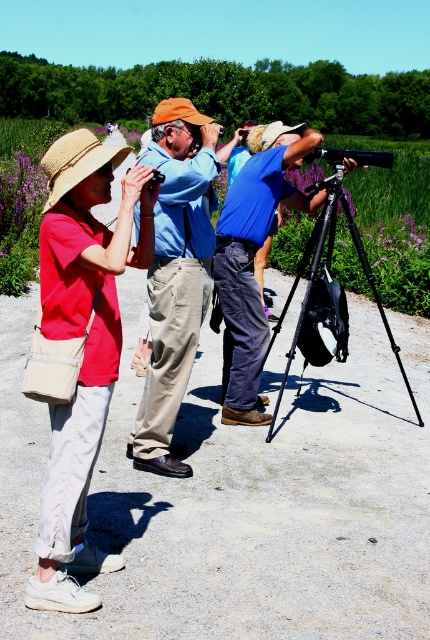
Is point (184, 385) closer to viewer compared to point (322, 234)?

Yes, point (184, 385) is closer to viewer.

Which is in front, point (157, 408) or point (307, 340)?

Point (157, 408) is in front.

Measure the distance between matte blue shirt at center and camera.

matte blue shirt at center is 3.69 meters from camera.

Locate an element on the screen. matte blue shirt at center is located at coordinates (175, 275).

Is matte straw hat at left bigger than blue fabric shirt at center?

Yes, matte straw hat at left is bigger than blue fabric shirt at center.

Does point (113, 384) come closer to viewer compared to point (264, 234)?

Yes.

This screenshot has width=430, height=640. I want to click on matte straw hat at left, so click(83, 348).

Does matte straw hat at left have a larger size compared to matte blue shirt at center?

No.

Find the location of `matte straw hat at left`. matte straw hat at left is located at coordinates (83, 348).

What do you see at coordinates (83, 348) in the screenshot?
I see `matte straw hat at left` at bounding box center [83, 348].

Identify the location of matte straw hat at left. The image size is (430, 640). (83, 348).